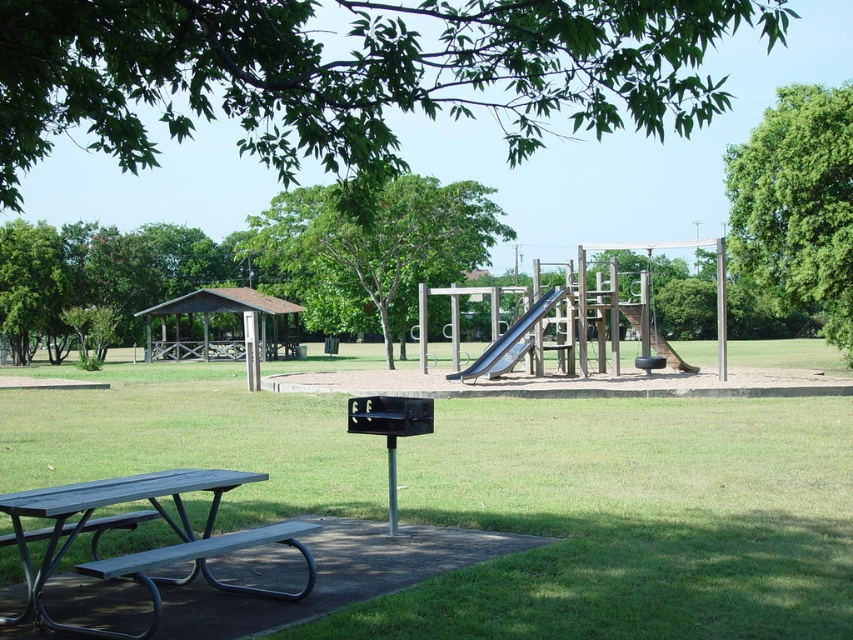
Measure the distance between point (55, 65) and camera.

A distance of 6.56 meters exists between point (55, 65) and camera.

How distant is green leafy tree at upper center from green leafy tree at center?

8.18 meters

Find the location of `green leafy tree at upper center`. green leafy tree at upper center is located at coordinates (352, 76).

Between green leafy tree at center and smooth gray slide at center, which one has more height?

green leafy tree at center is taller.

Is point (402, 211) farther from camera compared to point (662, 337)?

No, (402, 211) is in front of (662, 337).

Locate an element on the screen. The height and width of the screenshot is (640, 853). green leafy tree at center is located at coordinates (373, 248).

Which of these two, green grass at center or smooth gray slide at center, stands taller?

smooth gray slide at center is taller.

Who is shorter, green grass at center or smooth gray slide at center?

green grass at center is shorter.

Is point (788, 413) positioned before point (668, 349)?

Yes, point (788, 413) is in front of point (668, 349).

Where is `green grass at center`? green grass at center is located at coordinates (630, 518).